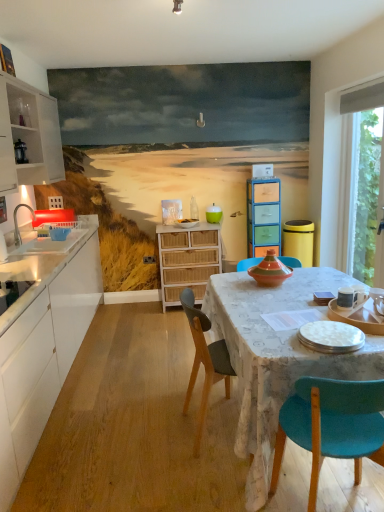
Identify the location of free space to the left of wooden chair at center, which is counted as the first chair, starting from the back. Image resolution: width=384 pixels, height=512 pixels. (146, 448).